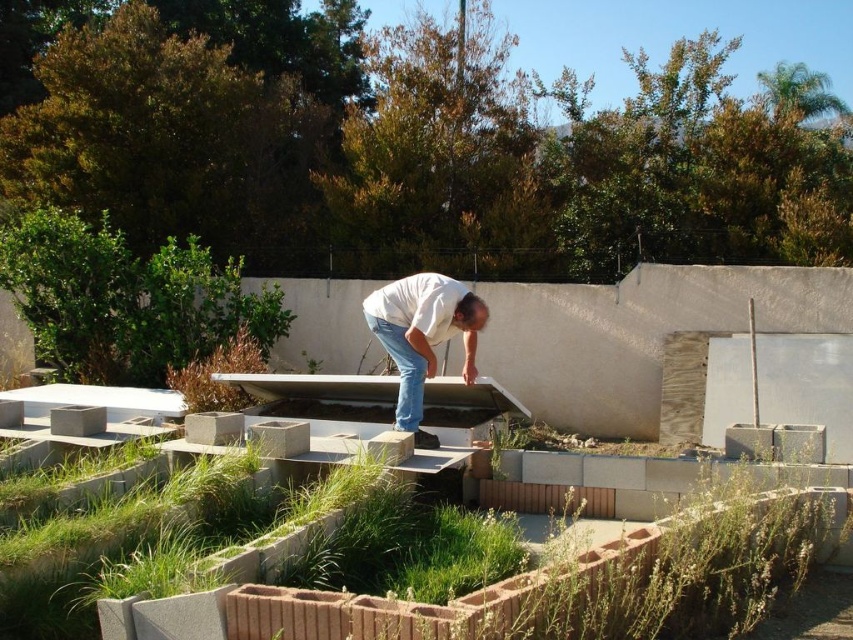
Question: Is white matte shirt at center smaller than jeans at center?

Choices:
 (A) yes
 (B) no

Answer: (B)

Question: Is white matte shirt at center to the left of jeans at center from the viewer's perspective?

Choices:
 (A) yes
 (B) no

Answer: (B)

Question: Does white matte shirt at center appear under jeans at center?

Choices:
 (A) yes
 (B) no

Answer: (B)

Question: Which point is farther from the camera taking this photo?

Choices:
 (A) (405, 328)
 (B) (399, 420)

Answer: (A)

Question: Which of the following is the closest to the observer?

Choices:
 (A) (397, 348)
 (B) (436, 282)

Answer: (B)